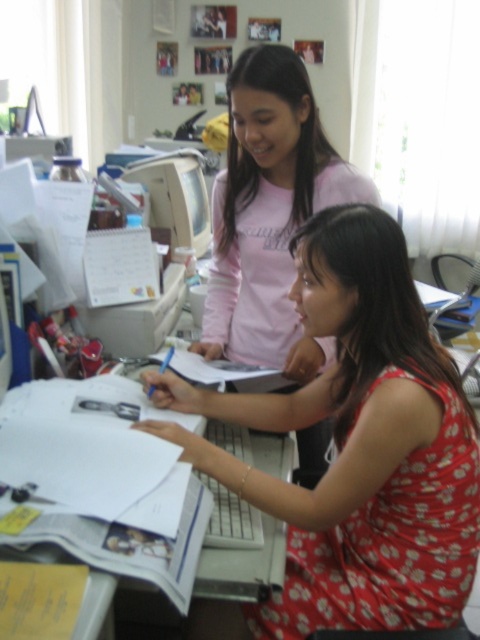
Who is taller, floral fabric dress at center or pink cotton shirt at upper center?

pink cotton shirt at upper center is taller.

Does floral fabric dress at center have a smaller size compared to pink cotton shirt at upper center?

Yes, floral fabric dress at center is smaller than pink cotton shirt at upper center.

Is point (384, 444) farther from viewer compared to point (312, 346)?

That is False.

Where is `floral fabric dress at center`? The image size is (480, 640). floral fabric dress at center is located at coordinates (355, 449).

Between floral fabric dress at center and matte plastic monitor at center, which one appears on the left side from the viewer's perspective?

matte plastic monitor at center

Can you confirm if floral fabric dress at center is positioned above matte plastic monitor at center?

No, floral fabric dress at center is not above matte plastic monitor at center.

Describe the element at coordinates (355, 449) in the screenshot. Image resolution: width=480 pixels, height=640 pixels. I see `floral fabric dress at center` at that location.

Locate an element on the screen. floral fabric dress at center is located at coordinates (355, 449).

Is point (240, 296) positioned behind point (177, 168)?

That is False.

Can you confirm if pink cotton shirt at upper center is positioned to the left of matte plastic monitor at center?

No, pink cotton shirt at upper center is not to the left of matte plastic monitor at center.

This screenshot has width=480, height=640. I want to click on pink cotton shirt at upper center, so click(269, 212).